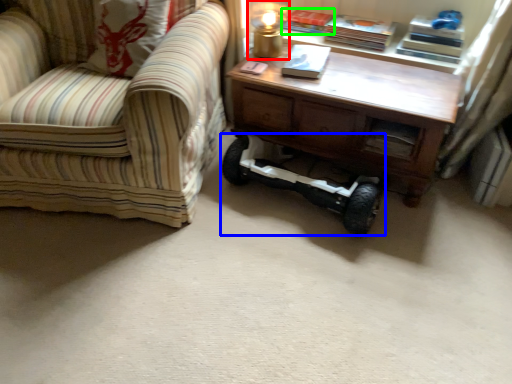
Question: Which object is positioned closest to table lamp (highlighted by a red box)? Select from segway (highlighted by a blue box) and book (highlighted by a green box).

Choices:
 (A) segway
 (B) book

Answer: (B)